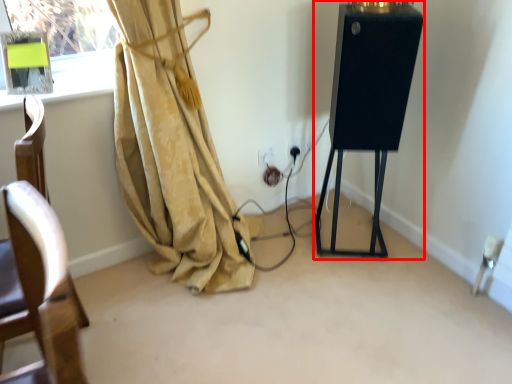
Question: From the image's perspective, where is easel (annotated by the red box) located relative to electric outlet?

Choices:
 (A) below
 (B) above

Answer: (B)